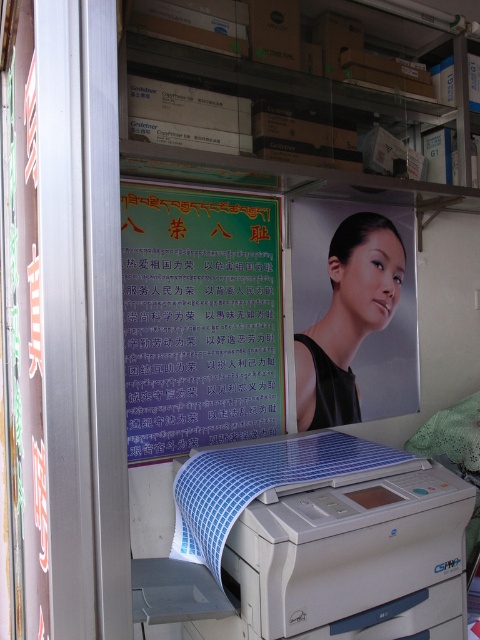
Question: Does green paper poster at center appear on the right side of matte black portrait at center?

Choices:
 (A) yes
 (B) no

Answer: (B)

Question: Which is nearer to the matte black portrait at center?

Choices:
 (A) white plastic printer at lower center
 (B) green paper poster at center

Answer: (B)

Question: Which point appears closest to the camera in this image?

Choices:
 (A) (140, 406)
 (B) (299, 344)
 (C) (259, 566)

Answer: (C)

Question: Which of the following is the farthest from the observer?

Choices:
 (A) matte black portrait at center
 (B) green paper poster at center

Answer: (A)

Question: Can you confirm if green paper poster at center is thinner than white plastic printer at lower center?

Choices:
 (A) yes
 (B) no

Answer: (A)

Question: Is green paper poster at center further to the viewer compared to white plastic printer at lower center?

Choices:
 (A) yes
 (B) no

Answer: (A)